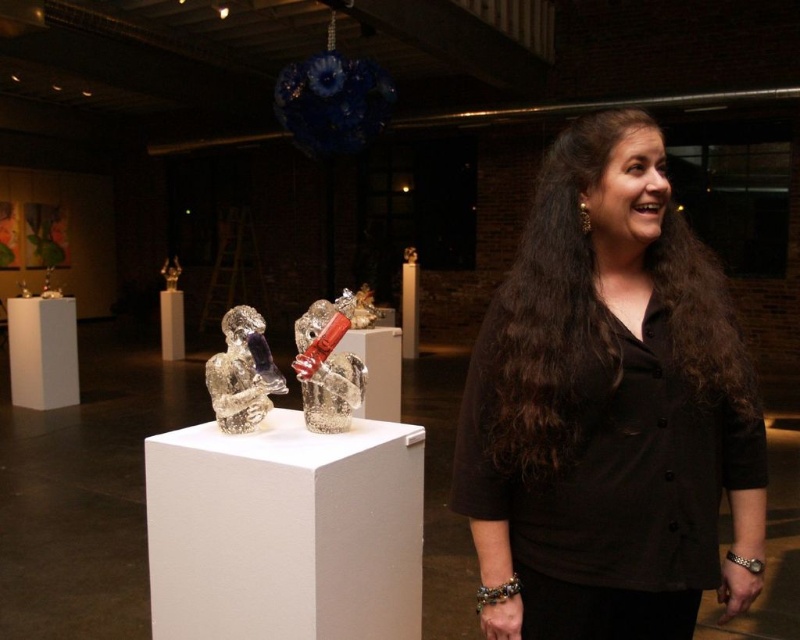
Based on the photo, you are an art critic analyzing the composition of the image. Based on the spatial relationship between the black matte shirt at center and the clear glass sculpture at center, which one appears larger in the artwork?

The black matte shirt at center is taller than the clear glass sculpture at center, so it appears larger in the artwork.

You are a photographer trying to capture the two points in the image. Which point, point (578, 497) or point (226, 353), will appear larger in your photo?

Point (578, 497) is closer to the camera than point (226, 353), so it will appear larger in the photo.